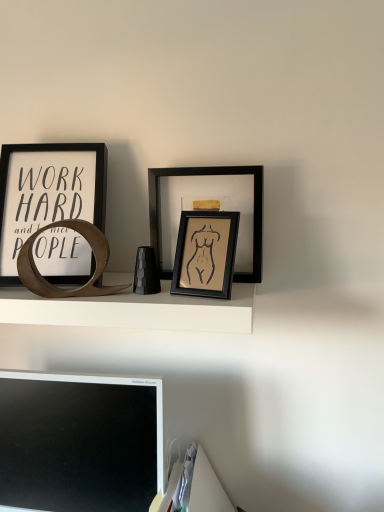
Find the location of a particular element. vacant region to the right of matte black picture frame at left, the 3th picture frame in the right-to-left sequence is located at coordinates (122, 289).